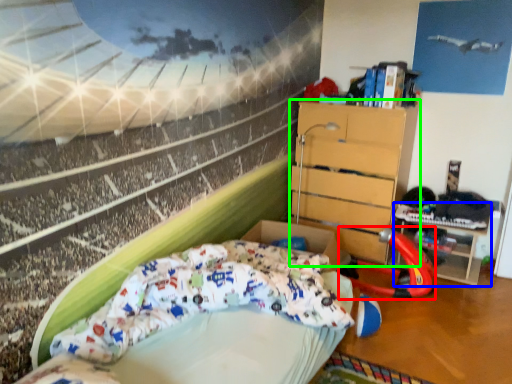
Question: Estimate the real-world distances between objects in this image. Which object is closer to sport equipment (highlighted by a red box), table (highlighted by a blue box) or chest of drawers (highlighted by a green box)?

Choices:
 (A) table
 (B) chest of drawers

Answer: (A)